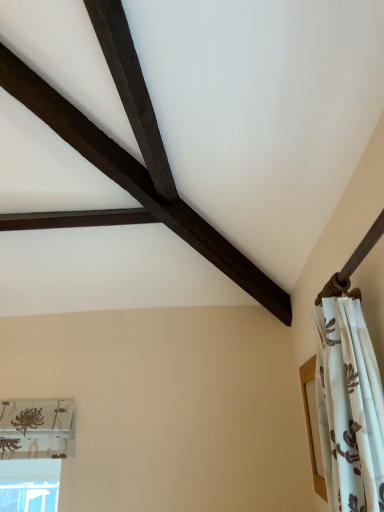
Question: Considering the relative sizes of transparent glass window at lower left and white floral fabric curtain at right in the image provided, is transparent glass window at lower left bigger than white floral fabric curtain at right?

Choices:
 (A) no
 (B) yes

Answer: (A)

Question: Is transparent glass window at lower left further to the viewer compared to white floral fabric curtain at right?

Choices:
 (A) yes
 (B) no

Answer: (A)

Question: Is the position of transparent glass window at lower left less distant than that of white floral fabric curtain at right?

Choices:
 (A) yes
 (B) no

Answer: (B)

Question: Is white floral fabric curtain at right inside transparent glass window at lower left?

Choices:
 (A) no
 (B) yes

Answer: (A)

Question: From the image's perspective, would you say transparent glass window at lower left is shown under white floral fabric curtain at right?

Choices:
 (A) no
 (B) yes

Answer: (B)

Question: Would you consider transparent glass window at lower left to be distant from white floral fabric curtain at right?

Choices:
 (A) yes
 (B) no

Answer: (A)

Question: Is white floral fabric curtain at right further to camera compared to transparent glass window at lower left?

Choices:
 (A) yes
 (B) no

Answer: (B)

Question: Does white floral fabric curtain at right contain transparent glass window at lower left?

Choices:
 (A) yes
 (B) no

Answer: (B)

Question: From a real-world perspective, is white floral fabric curtain at right on transparent glass window at lower left?

Choices:
 (A) no
 (B) yes

Answer: (B)

Question: Can you confirm if white floral fabric curtain at right is positioned to the right of transparent glass window at lower left?

Choices:
 (A) yes
 (B) no

Answer: (A)

Question: Can you confirm if white floral fabric curtain at right is positioned to the left of transparent glass window at lower left?

Choices:
 (A) no
 (B) yes

Answer: (A)

Question: Can you confirm if white floral fabric curtain at right is wider than transparent glass window at lower left?

Choices:
 (A) no
 (B) yes

Answer: (A)

Question: From the image's perspective, is white floral fabric curtain at right above or below transparent glass window at lower left?

Choices:
 (A) below
 (B) above

Answer: (B)